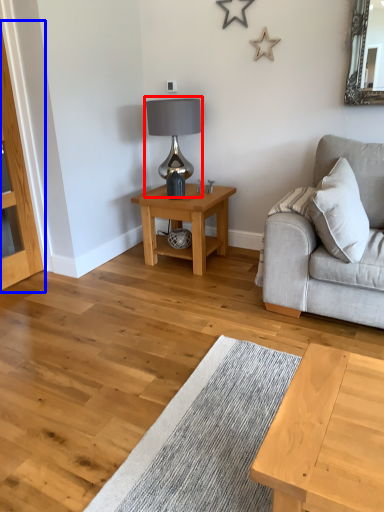
Question: Which point is further to the camera, table lamp (highlighted by a red box) or dresser (highlighted by a blue box)?

Choices:
 (A) table lamp
 (B) dresser

Answer: (A)